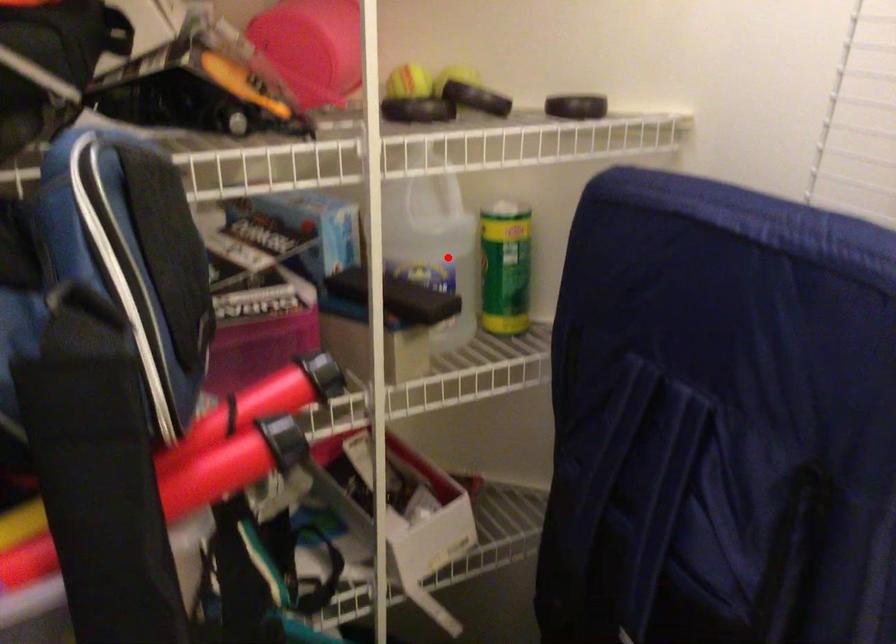
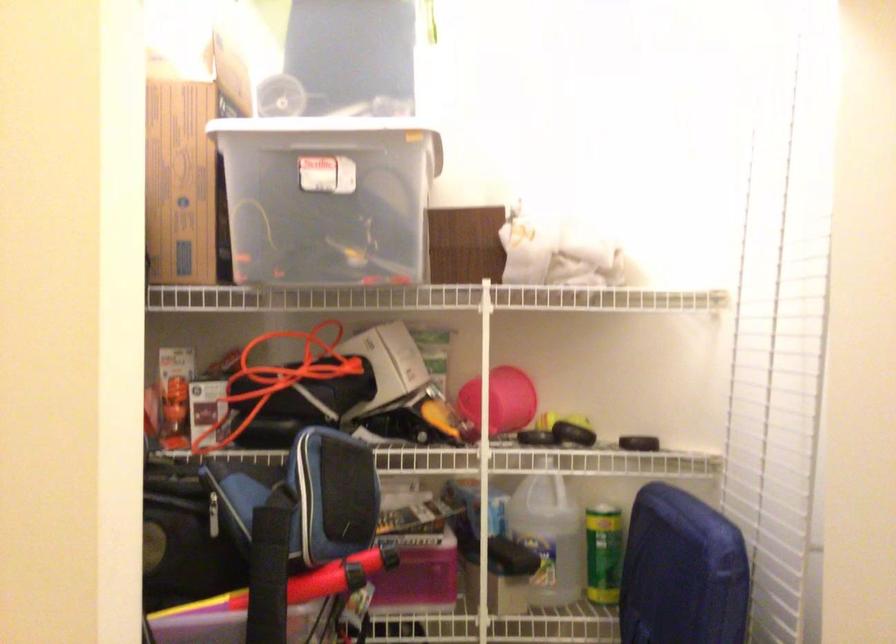
Question: I am providing you with two images of the same scene from different viewpoints. A red point is marked on the first image. At the location where the point appears in image 1, is it still visible in image 2?

Choices:
 (A) Yes
 (B) No

Answer: (A)